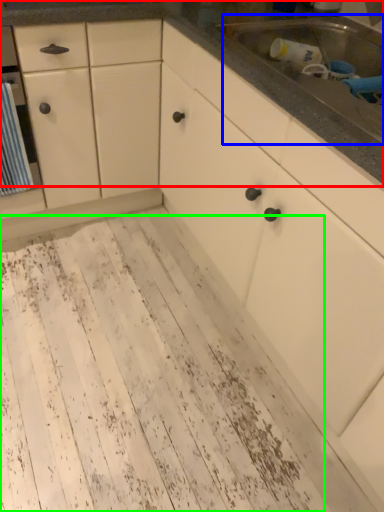
Question: Which is farther away from countertop (highlighted by a red box)? sink (highlighted by a blue box) or mud (highlighted by a green box)?

Choices:
 (A) sink
 (B) mud

Answer: (B)